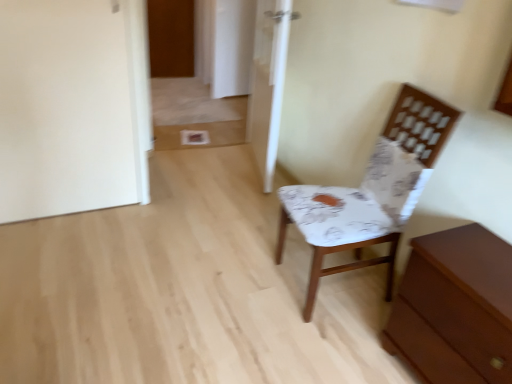
Question: Looking at their shapes, would you say white glossy door at center, placed as the 1th door when sorted from right to left, is wider or thinner than brown wooden chest of drawers at lower right?

Choices:
 (A) thin
 (B) wide

Answer: (A)

Question: From the image's perspective, relative to brown wooden chest of drawers at lower right, is white glossy door at center, arranged as the 1th door when ordered from the bottom, above or below?

Choices:
 (A) below
 (B) above

Answer: (B)

Question: Based on their relative distances, which object is farther from the white glossy door at center, the 2th door when ordered from back to front?

Choices:
 (A) brown wooden chest of drawers at lower right
 (B) white fabric chair at right
 (C) wooden door at upper left, positioned as the second door in bottom-to-top order

Answer: (C)

Question: Which is nearer to the white glossy door at center, which appears as the 1th door when viewed from the front?

Choices:
 (A) white fabric chair at right
 (B) brown wooden chest of drawers at lower right
 (C) wooden door at upper left, which is counted as the 2th door, starting from the front

Answer: (A)